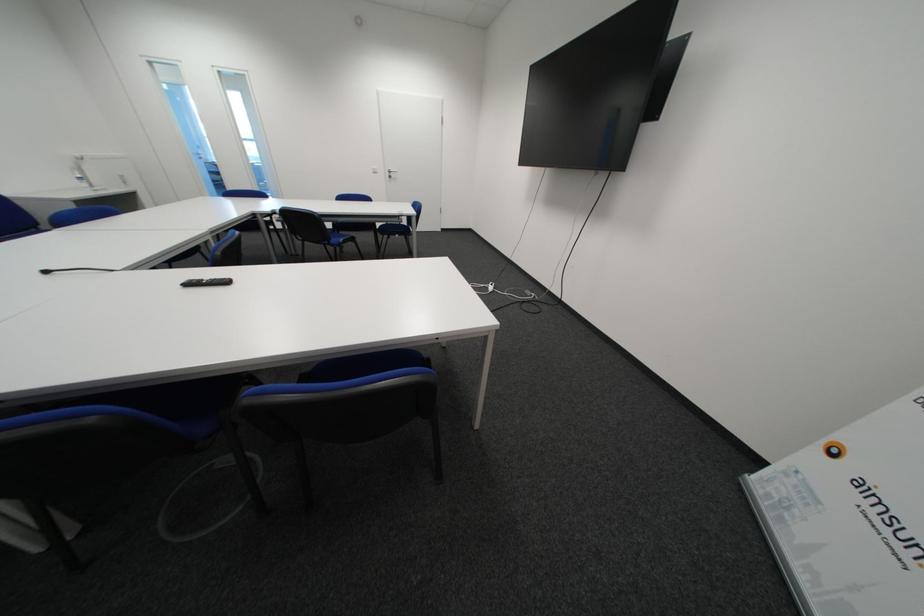
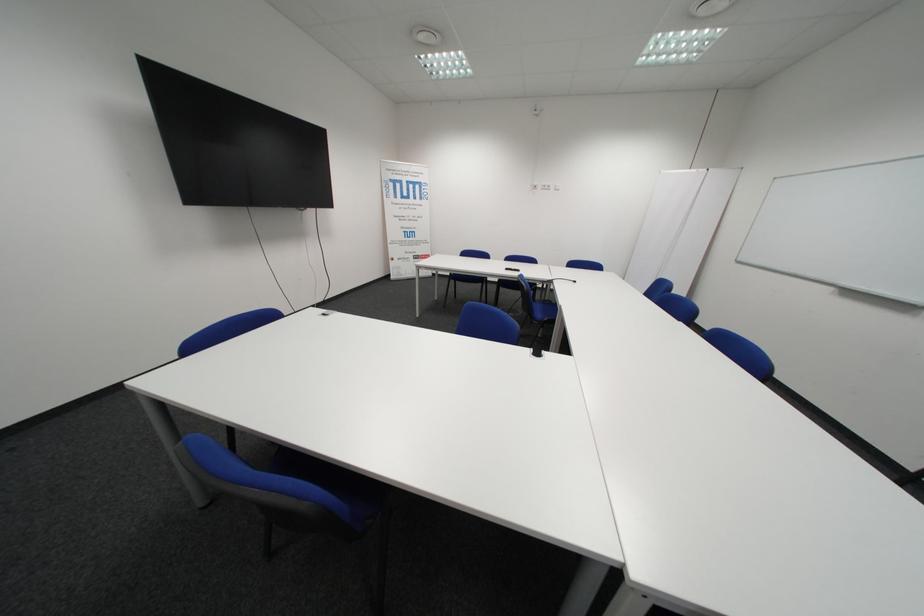
Locate, in the second image, the point that corresponds to pixel 237 284 in the first image.

(518, 270)